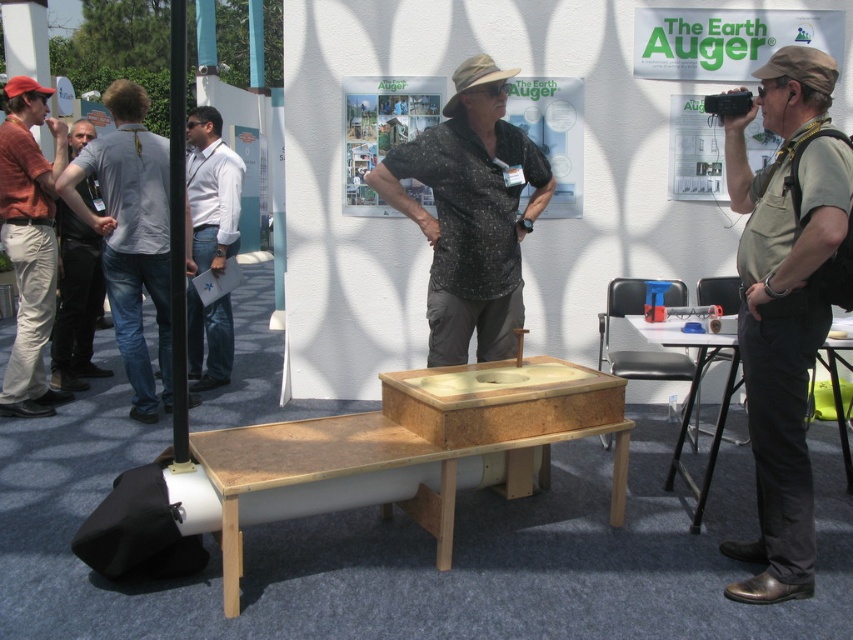
Question: Which object is positioned farthest from the light gray shirt at left?

Choices:
 (A) matte orange shirt at left
 (B) black plastic table at lower right

Answer: (B)

Question: Among these objects, which one is farthest from the camera?

Choices:
 (A) light gray shirt at left
 (B) black dotted shirt at center

Answer: (A)

Question: Can you confirm if khaki fabric shirt at center is smaller than gray cotton shirt at left?

Choices:
 (A) yes
 (B) no

Answer: (A)

Question: Considering the real-world distances, which object is farthest from the khaki fabric shirt at center?

Choices:
 (A) wooden table at center
 (B) black plastic table at lower right
 (C) matte orange shirt at left
 (D) white shirt at center

Answer: (C)

Question: Is gray cotton shirt at left to the left of light gray shirt at left from the viewer's perspective?

Choices:
 (A) yes
 (B) no

Answer: (B)

Question: Can you confirm if black dotted shirt at center is positioned to the right of gray cotton shirt at left?

Choices:
 (A) no
 (B) yes

Answer: (B)